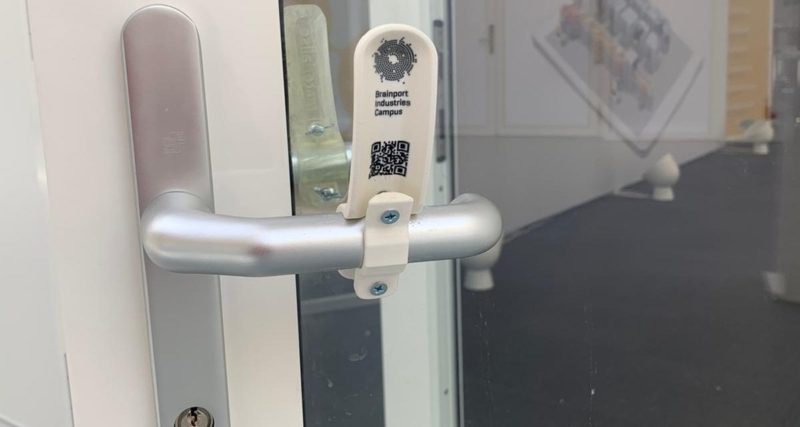
Locate an element on the screen. handle is located at coordinates (289, 248).